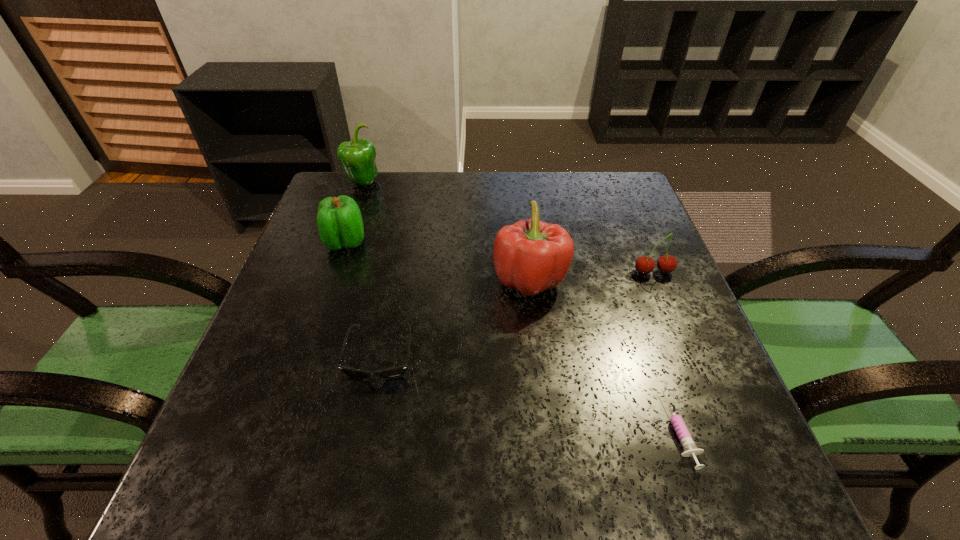
Image resolution: width=960 pixels, height=540 pixels. In order to click on vacant space that satisfies the following two spatial constraints: 1. on the front-facing side of the sunglasses; 2. on the right side of the nearest object in this screenshot , I will do `click(366, 429)`.

Where is `free space that satisfies the following two spatial constraints: 1. on the front side of the farthest object; 2. on the left side of the nearest object`? free space that satisfies the following two spatial constraints: 1. on the front side of the farthest object; 2. on the left side of the nearest object is located at coordinates (275, 429).